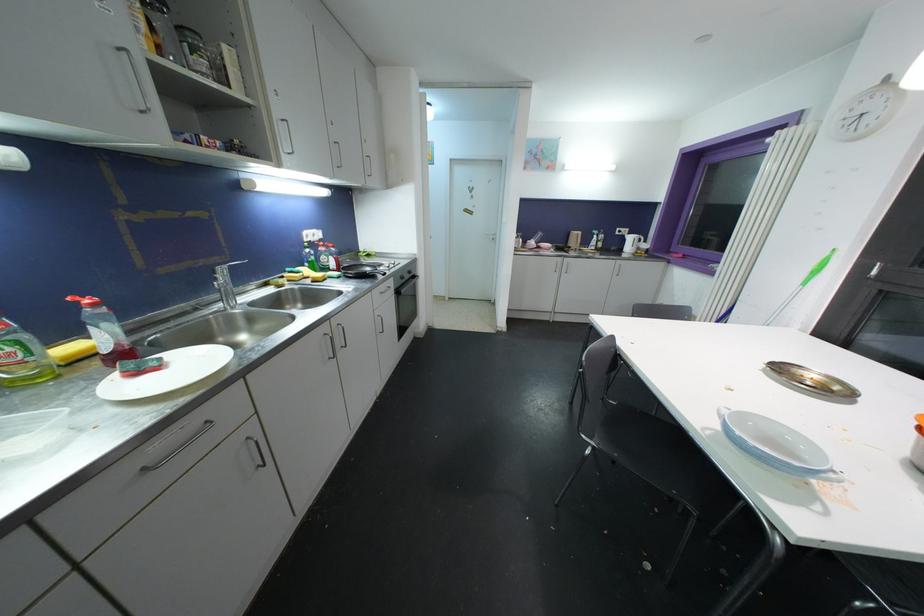
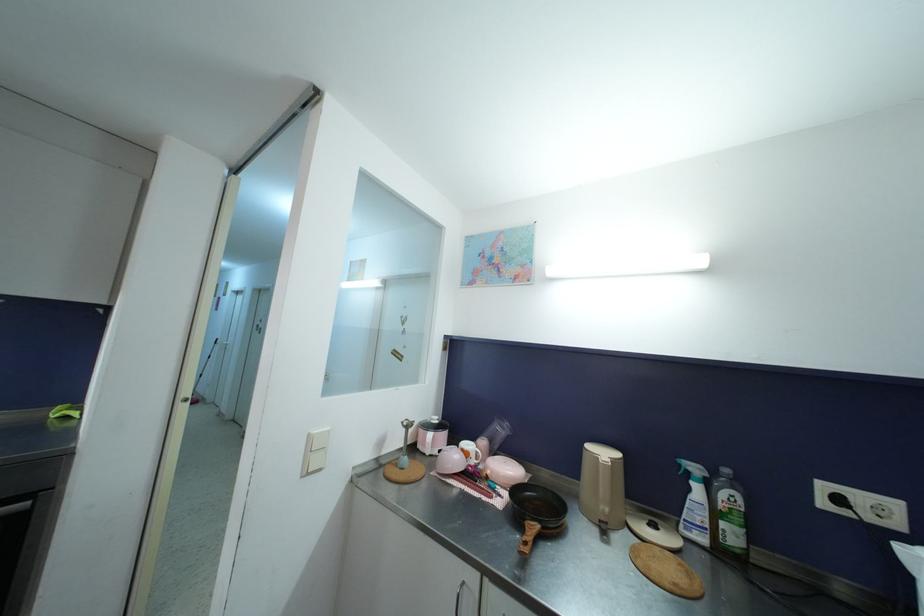
Find the pixel in the second image that matches point 619,236 in the first image.

(827, 507)